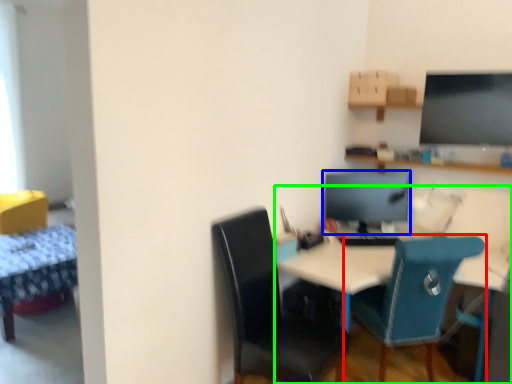
Question: Which object is the farthest from chair (highlighted by a red box)? Choose among these: computer monitor (highlighted by a blue box) or desk (highlighted by a green box).

Choices:
 (A) computer monitor
 (B) desk

Answer: (A)